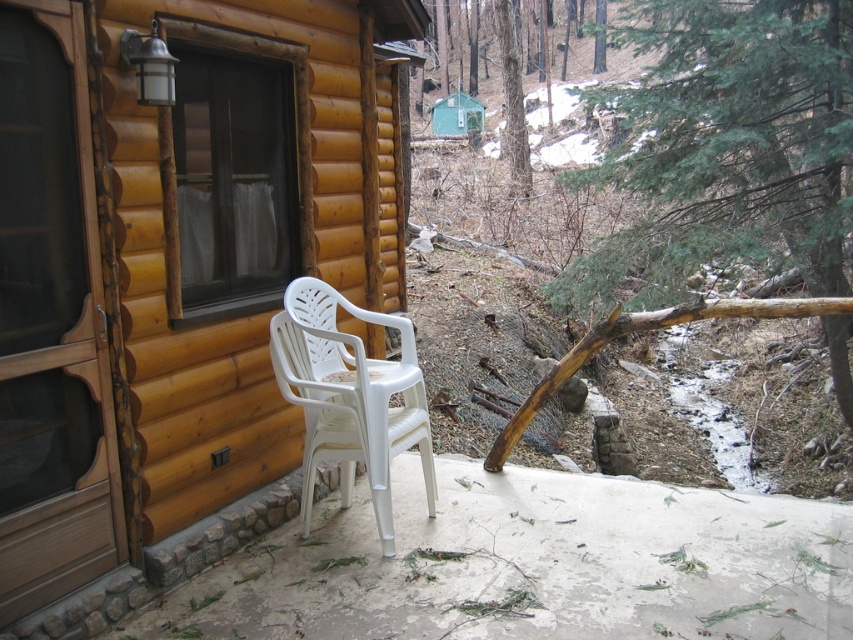
Can you confirm if matte plastic chair at lower right is positioned to the right of white plastic chair at lower center?

No, matte plastic chair at lower right is not to the right of white plastic chair at lower center.

The width and height of the screenshot is (853, 640). Describe the element at coordinates (171, 269) in the screenshot. I see `matte plastic chair at lower right` at that location.

This screenshot has width=853, height=640. I want to click on matte plastic chair at lower right, so click(171, 269).